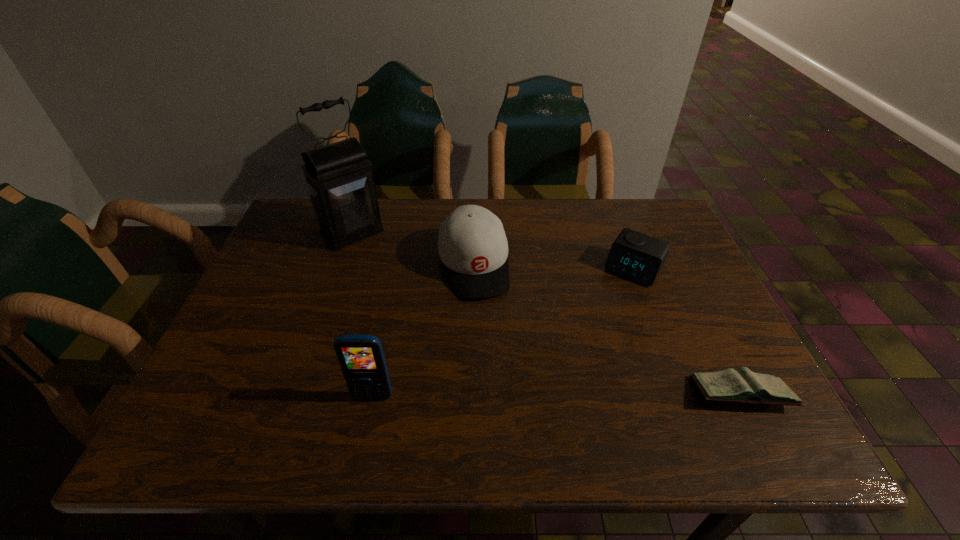
I want to click on object that is the closest one to the fourth object from right to left, so click(x=472, y=244).

Identify the location of object that is the third closest one to the fourth shortest object. This screenshot has height=540, width=960. (633, 255).